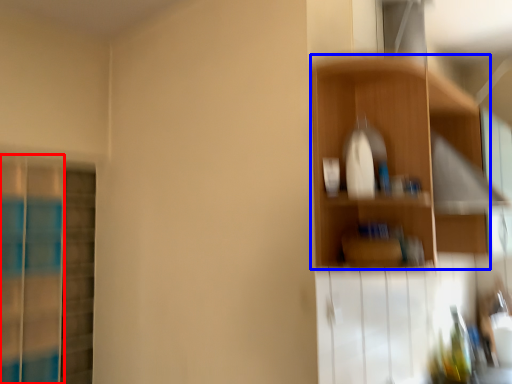
Question: Which object is further to the camera taking this photo, screen door (highlighted by a red box) or shelf (highlighted by a blue box)?

Choices:
 (A) screen door
 (B) shelf

Answer: (A)